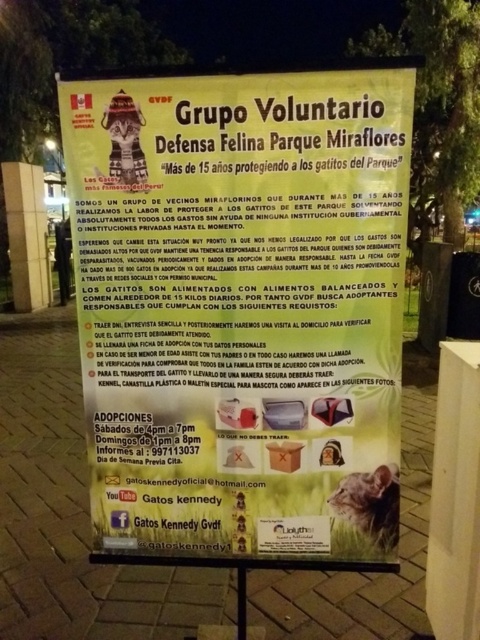
You are a delivery robot with a 12 inch wide package that needs to be placed between the white paper poster at center and the fuzzy brown cat at lower right. Is there enough space for the package to fit between them?

The distance between the white paper poster at center and the fuzzy brown cat at lower right is 17.32 inches. Since the package is 12 inches wide, there is enough space for the package to fit between them as 17.32 inches is greater than 12 inches.

You are a delivery person who needs to place a small box on the white paper poster at center without covering the fuzzy brown cat at lower right. Is there enough space on the poster to do this?

The white paper poster at center might be wider than fuzzy brown cat at lower right, so there might be enough space to place the small box without covering the cat. However, the exact dimensions are uncertain based on the given information.